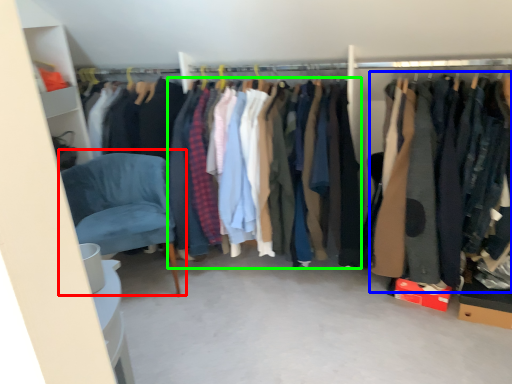
Question: Which is nearer to the chair (highlighted by a red box)? clothing (highlighted by a blue box) or clothing (highlighted by a green box).

Choices:
 (A) clothing
 (B) clothing

Answer: (B)